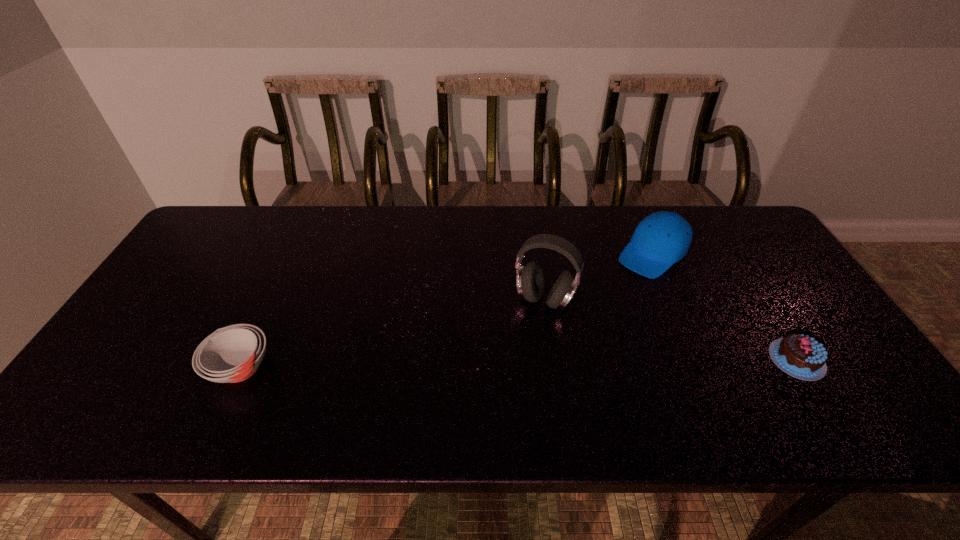
Locate an element on the screen. Image resolution: width=960 pixels, height=540 pixels. free space between the leftmost object and the cap is located at coordinates (446, 310).

The image size is (960, 540). I want to click on blank region between the chocolate cake and the soup bowl, so click(x=518, y=364).

Find the location of a particular element. The height and width of the screenshot is (540, 960). vacant region between the second tallest object and the third object from right to left is located at coordinates (598, 276).

Locate an element on the screen. This screenshot has height=540, width=960. free space between the tallest object and the third object from left to right is located at coordinates (598, 276).

Identify which object is the second closest to the leftmost object. Please provide its 2D coordinates. Your answer should be formatted as a tuple, i.e. [(x, y)], where the tuple contains the x and y coordinates of a point satisfying the conditions above.

[(663, 238)]

In order to click on object that ranks as the second closest to the tallest object in this screenshot , I will do `click(800, 356)`.